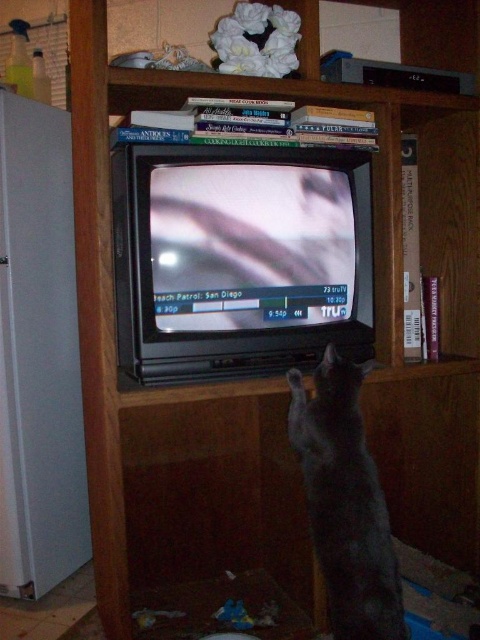
Question: Which of the following is the farthest from the observer?

Choices:
 (A) shiny gray cat at center
 (B) white matte refrigerator at left

Answer: (B)

Question: Is white matte refrigerator at left smaller than shiny gray cat at center?

Choices:
 (A) no
 (B) yes

Answer: (A)

Question: Does white matte refrigerator at left lie behind shiny gray cat at center?

Choices:
 (A) no
 (B) yes

Answer: (B)

Question: Does white matte refrigerator at left appear on the right side of shiny gray cat at center?

Choices:
 (A) yes
 (B) no

Answer: (B)

Question: Which point is closer to the camera?

Choices:
 (A) shiny gray cat at center
 (B) white matte refrigerator at left

Answer: (A)